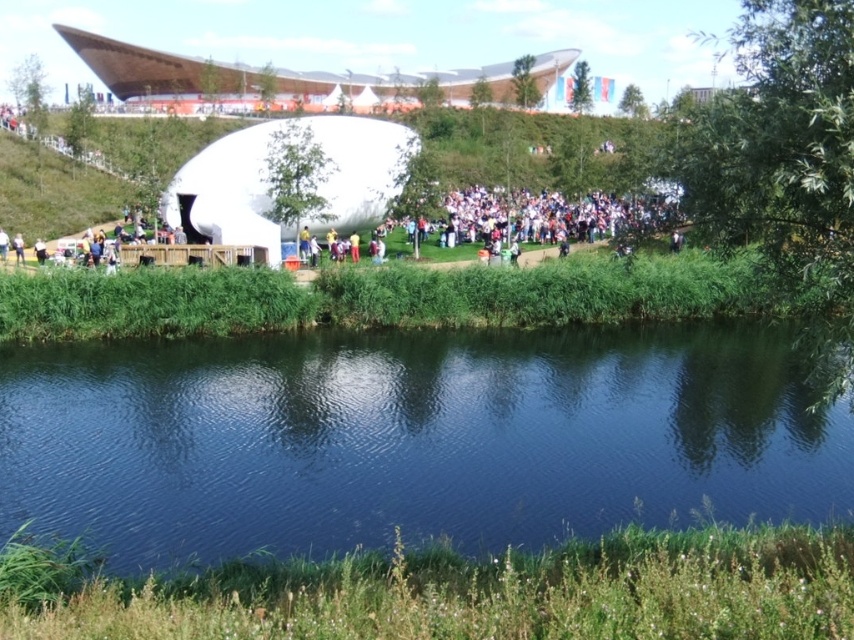
You are a photographer standing on the wooden platform in the midground. You want to take a photo that includes both the dark blue water at center and the yellow fabric person at center. Which object should be placed closer to the front of the frame to ensure both are in focus?

The yellow fabric person at center should be placed closer to the front of the frame because the dark blue water at center is taller than the yellow fabric person at center, so positioning the shorter object forward helps maintain focus on both.

You are standing at the point with coordinates point (303, 243). What is the object you are standing on?

You are standing on the blue fabric person at center.

You are standing at the edge of the lake and want to approach both the yellow fabric person at center and the white matte person at center. Which one should you walk towards first to reach the closer one?

You should walk towards the yellow fabric person at center first because it is closer to you than the white matte person at center.